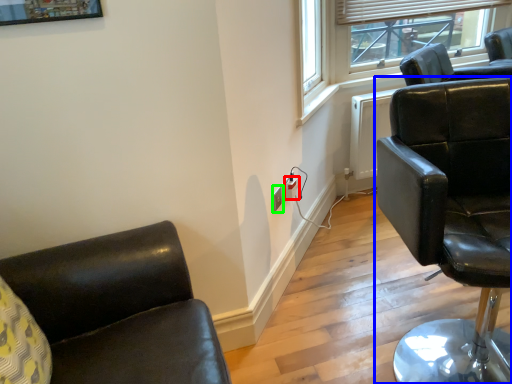
Question: Based on their relative distances, which object is farther from electric outlet (highlighted by a red box)? Choose from chair (highlighted by a blue box) and electric outlet (highlighted by a green box).

Choices:
 (A) chair
 (B) electric outlet

Answer: (A)